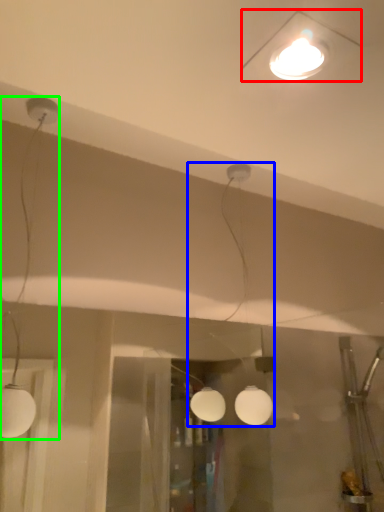
Question: Estimate the real-world distances between objects in this image. Which object is farther from lamp (highlighted by a red box), lamp (highlighted by a blue box) or lamp (highlighted by a green box)?

Choices:
 (A) lamp
 (B) lamp

Answer: (B)